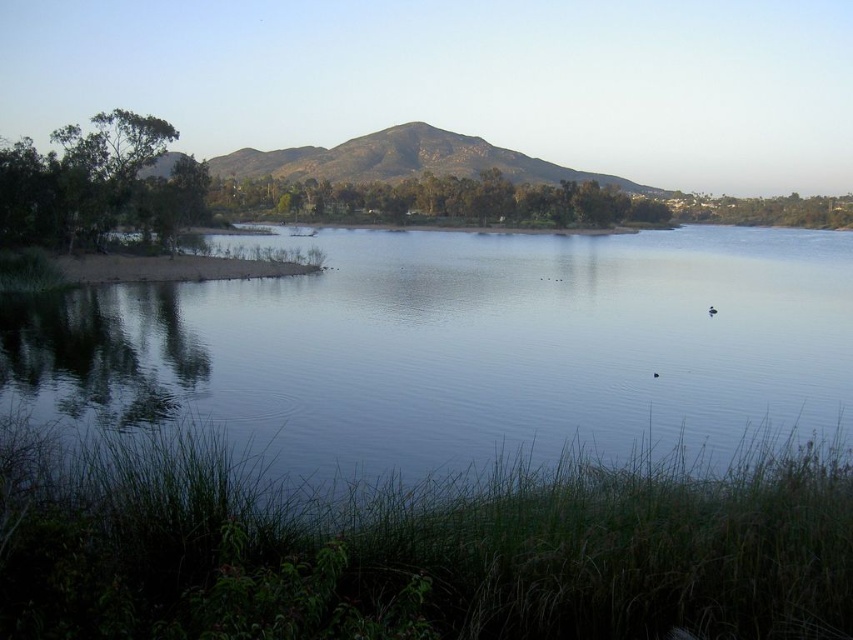
You are standing at the lakeside and want to reach both points marked in the image. Which point, point (479, 330) or point (390, 148), is closer to your current position?

Point (479, 330) is closer to the camera than point (390, 148), so it is closer to your current position.